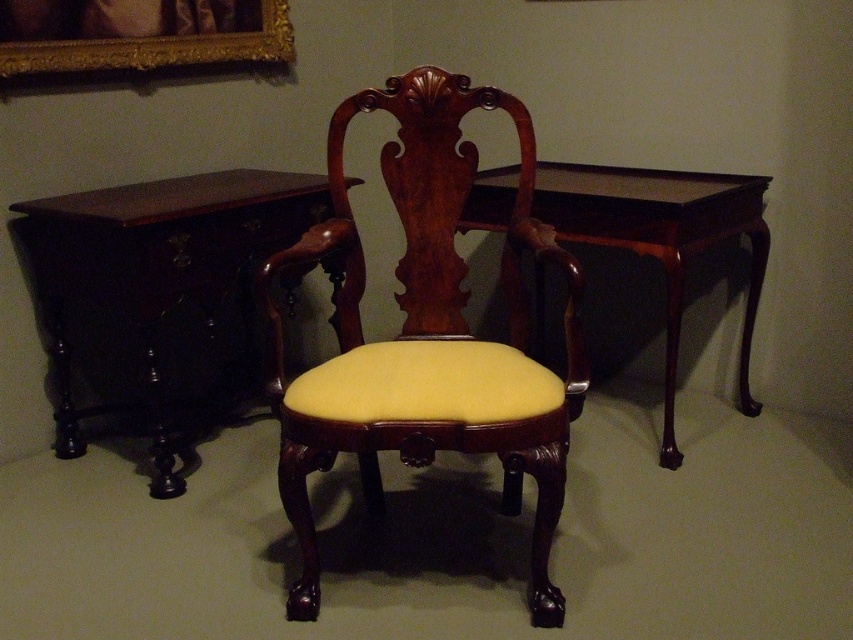
Question: Is mahogany wood armchair at center behind dark wood table at left?

Choices:
 (A) no
 (B) yes

Answer: (A)

Question: Which object is farther from the camera taking this photo?

Choices:
 (A) dark wood table at left
 (B) gold ornate frame at upper left
 (C) mahogany wood armchair at center
 (D) mahogany wood table at center

Answer: (B)

Question: From the image, what is the correct spatial relationship of mahogany wood armchair at center in relation to dark wood table at left?

Choices:
 (A) left
 (B) right

Answer: (B)

Question: Can you confirm if mahogany wood armchair at center is positioned below mahogany wood table at center?

Choices:
 (A) yes
 (B) no

Answer: (A)

Question: Estimate the real-world distances between objects in this image. Which object is farther from the dark wood table at left?

Choices:
 (A) mahogany wood table at center
 (B) gold ornate frame at upper left
 (C) mahogany wood armchair at center

Answer: (A)

Question: Which of these objects is positioned farthest from the mahogany wood table at center?

Choices:
 (A) gold ornate frame at upper left
 (B) dark wood table at left
 (C) mahogany wood armchair at center

Answer: (A)